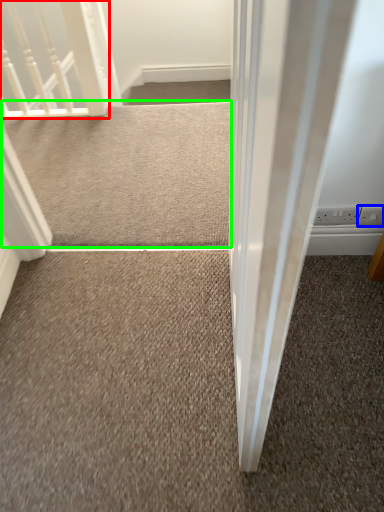
Question: Considering the real-world distances, which object is farthest from rail (highlighted by a red box)? electric outlet (highlighted by a blue box) or doormat (highlighted by a green box)?

Choices:
 (A) electric outlet
 (B) doormat

Answer: (A)